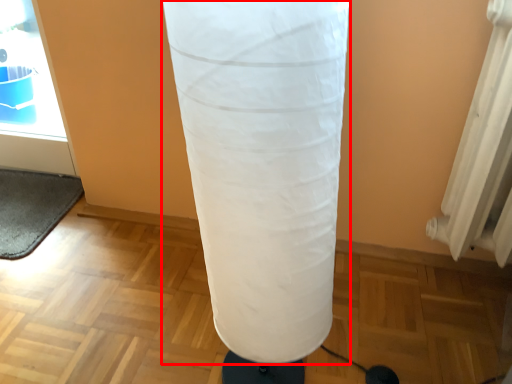
Question: From the image's perspective, what is the correct spatial positioning of punching bag (annotated by the red box) in reference to yoga mat?

Choices:
 (A) below
 (B) above

Answer: (A)